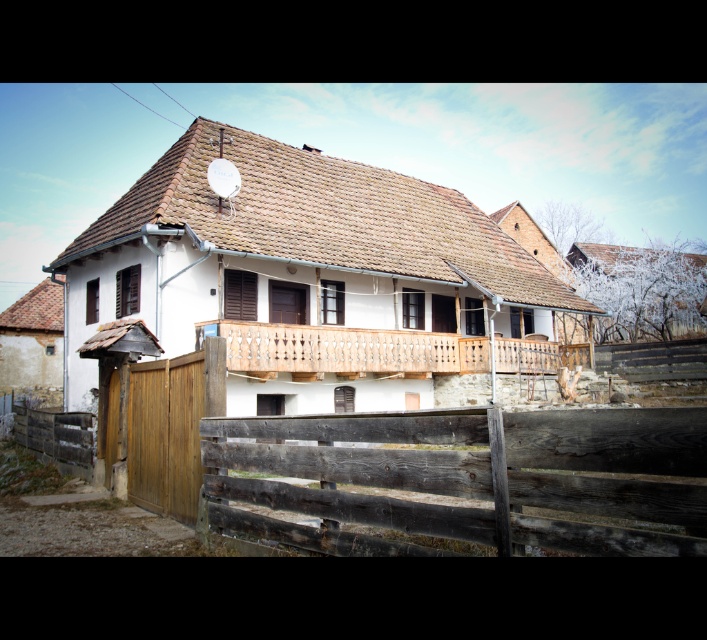
You are a gardener who wants to plant a row of flowers between the weathered wood fence at lower center and the wooden at center. If each flower requires 0.5 meters of space, how many flowers can you plant in a straight line between them?

The distance between the weathered wood fence at lower center and wooden at center is 6.38 meters. Each flower needs 0.5 meters of space. Dividing 6.38 by 0.5 gives approximately 12.76. Since you can only plant whole flowers, you can plant 12 flowers in a straight line between them.

You are a painter who needs to decide which object to paint first. The weathered wood fence at lower center and the wooden at center are both in your view. Which one is shorter in height?

The weathered wood fence at lower center is not as tall as wooden at center, so the weathered wood fence at lower center is shorter in height.